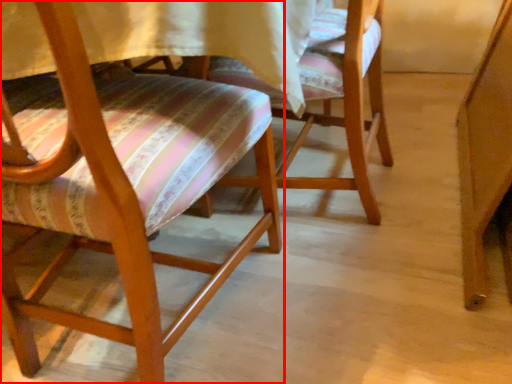
Question: Observing the image, what is the correct spatial positioning of chair (annotated by the red box) in reference to chair?

Choices:
 (A) left
 (B) right

Answer: (A)